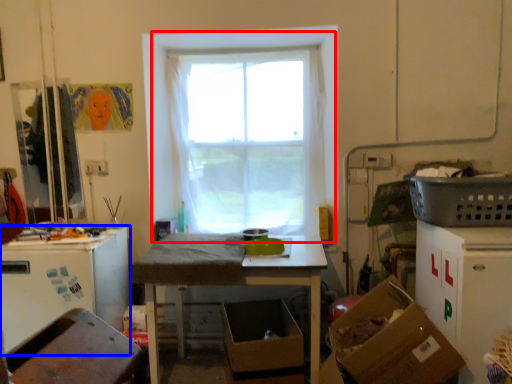
Question: Which object is further to the camera taking this photo, window (highlighted by a red box) or leftover (highlighted by a blue box)?

Choices:
 (A) window
 (B) leftover

Answer: (A)